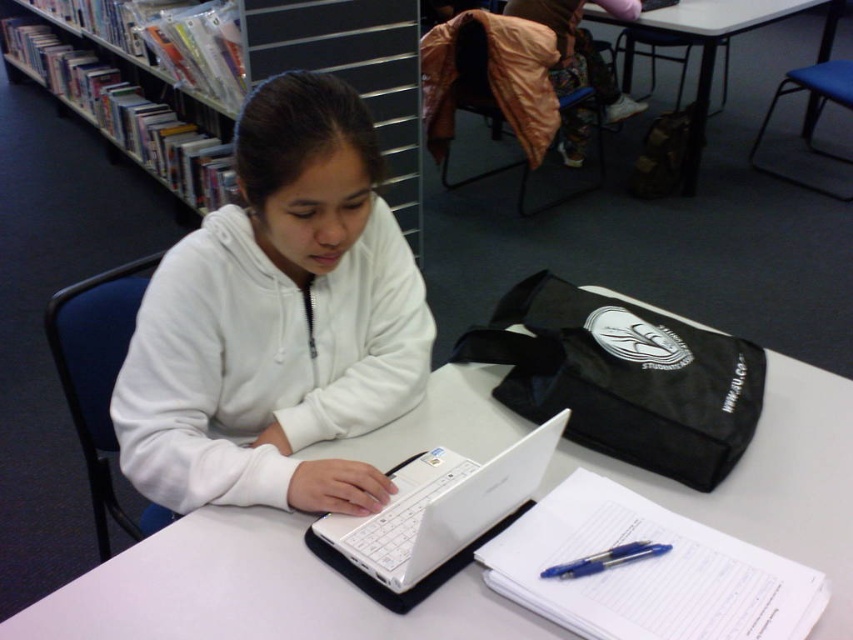
Question: Which of the following is the closest to the observer?

Choices:
 (A) (718, 17)
 (B) (776, 432)
 (C) (383, 19)

Answer: (B)

Question: Which object appears farthest from the camera in this image?

Choices:
 (A) white plastic table at center
 (B) white plastic laptop at center

Answer: (A)

Question: Does white plastic laptop at center appear on the left side of blue glossy pen at lower center?

Choices:
 (A) yes
 (B) no

Answer: (A)

Question: Which is nearer to the white fleece jacket at center?

Choices:
 (A) white plastic laptop at center
 (B) white plastic bookshelf at upper left
 (C) blue glossy pen at lower center

Answer: (A)

Question: Does white plastic table at center have a greater width compared to black plastic table at center?

Choices:
 (A) yes
 (B) no

Answer: (B)

Question: Is white fleece jacket at center below white plastic laptop at center?

Choices:
 (A) yes
 (B) no

Answer: (B)